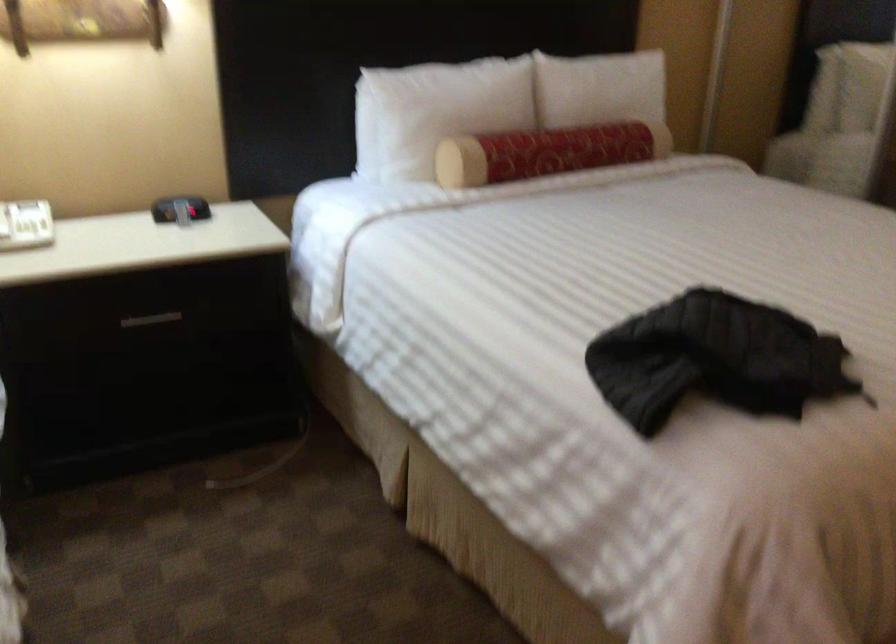
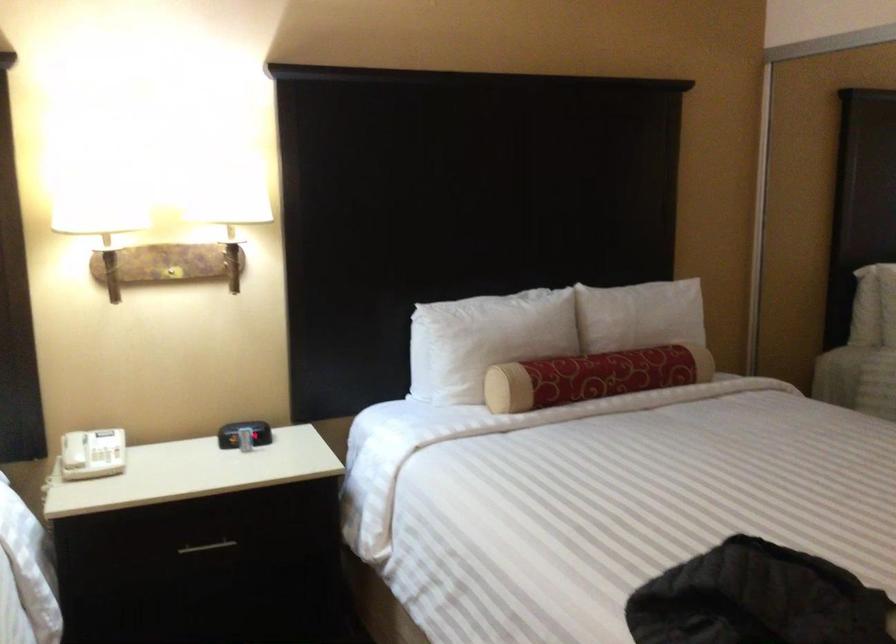
Locate, in the second image, the point that corresponds to point (606, 91) in the first image.

(643, 319)